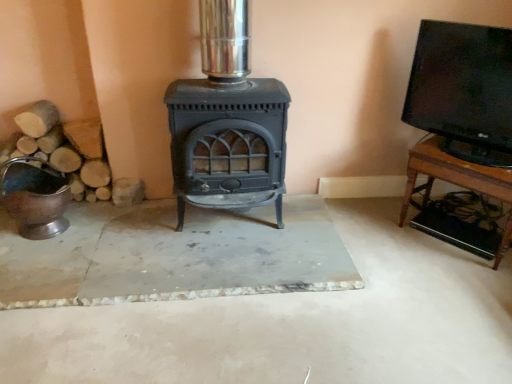
Question: Does black glossy tv at upper right have a larger size compared to shiny metallic bucket at left?

Choices:
 (A) yes
 (B) no

Answer: (A)

Question: Would you say black glossy tv at upper right contains shiny metallic bucket at left?

Choices:
 (A) no
 (B) yes

Answer: (A)

Question: Does black glossy tv at upper right have a greater height compared to shiny metallic bucket at left?

Choices:
 (A) yes
 (B) no

Answer: (A)

Question: Is black glossy tv at upper right positioned beyond the bounds of shiny metallic bucket at left?

Choices:
 (A) no
 (B) yes

Answer: (B)

Question: Considering the relative sizes of black glossy tv at upper right and shiny metallic bucket at left in the image provided, is black glossy tv at upper right smaller than shiny metallic bucket at left?

Choices:
 (A) yes
 (B) no

Answer: (B)

Question: From the image's perspective, is wooden tv stand at right above or below shiny metallic bucket at left?

Choices:
 (A) above
 (B) below

Answer: (A)

Question: Is wooden tv stand at right inside the boundaries of shiny metallic bucket at left, or outside?

Choices:
 (A) inside
 (B) outside

Answer: (B)

Question: Is wooden tv stand at right to the left or to the right of shiny metallic bucket at left in the image?

Choices:
 (A) left
 (B) right

Answer: (B)

Question: Considering their positions, is wooden tv stand at right located in front of or behind shiny metallic bucket at left?

Choices:
 (A) front
 (B) behind

Answer: (A)

Question: Looking at their shapes, would you say shiny metallic bucket at left is wider or thinner than matte black wood burning stove at center?

Choices:
 (A) wide
 (B) thin

Answer: (B)

Question: From the image's perspective, relative to matte black wood burning stove at center, is shiny metallic bucket at left above or below?

Choices:
 (A) above
 (B) below

Answer: (B)

Question: Does point (68, 190) appear closer or farther from the camera than point (241, 1)?

Choices:
 (A) closer
 (B) farther

Answer: (B)

Question: Visually, is shiny metallic bucket at left positioned to the left or to the right of matte black wood burning stove at center?

Choices:
 (A) right
 (B) left

Answer: (B)

Question: Which is correct: wooden tv stand at right is inside matte black wood burning stove at center, or outside of it?

Choices:
 (A) inside
 (B) outside

Answer: (B)

Question: Relative to matte black wood burning stove at center, is wooden tv stand at right in front or behind?

Choices:
 (A) front
 (B) behind

Answer: (B)